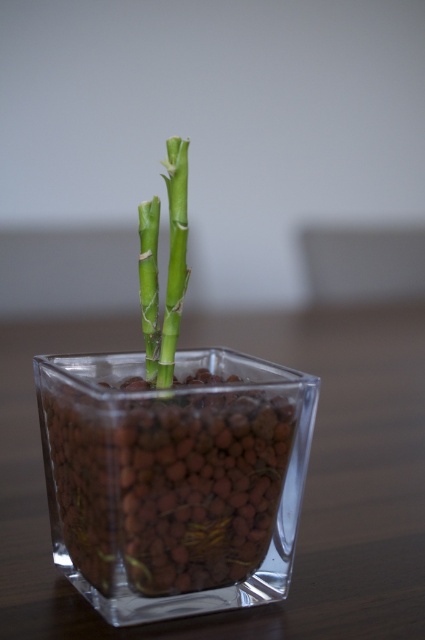
Question: Can you confirm if transparent glass vase at center is wider than green matte bamboo at center?

Choices:
 (A) yes
 (B) no

Answer: (A)

Question: Which object appears closest to the camera in this image?

Choices:
 (A) transparent glass vase at center
 (B) green matte bamboo at center

Answer: (A)

Question: Is transparent glass vase at center below green matte bamboo at center?

Choices:
 (A) yes
 (B) no

Answer: (A)

Question: Which point appears farthest from the camera in this image?

Choices:
 (A) (150, 332)
 (B) (135, 452)

Answer: (A)

Question: Can you confirm if transparent glass vase at center is wider than green matte bamboo at center?

Choices:
 (A) yes
 (B) no

Answer: (A)

Question: Which point is closer to the camera?

Choices:
 (A) green matte bamboo at center
 (B) transparent glass vase at center

Answer: (B)